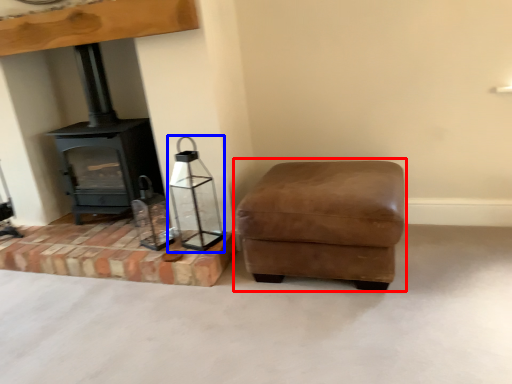
Question: Which object appears closest to the camera in this image, rocking chair (highlighted by a red box) or candle holder (highlighted by a blue box)?

Choices:
 (A) rocking chair
 (B) candle holder

Answer: (A)